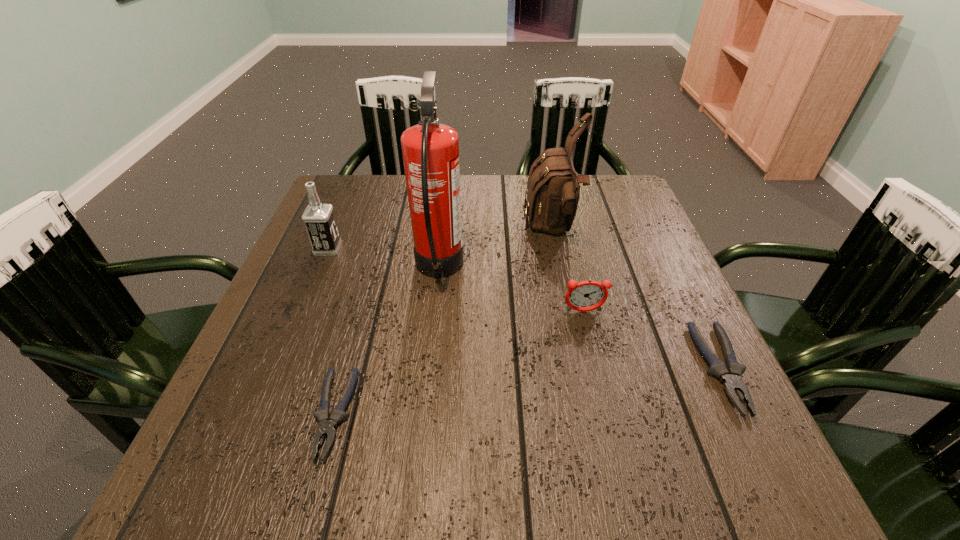
Where is `alarm clock`? The image size is (960, 540). alarm clock is located at coordinates coord(585,296).

The width and height of the screenshot is (960, 540). Identify the location of vacant area located 0.310m on the front-facing side of the third object from left to right. (595, 269).

This screenshot has width=960, height=540. I want to click on free location located on the front label of the fourth shortest object, so click(x=501, y=248).

Where is `free space located on the front-facing side of the fifth shortest object`? free space located on the front-facing side of the fifth shortest object is located at coordinates (386, 231).

Identify the location of vacant region located 0.160m on the front-facing side of the fifth shortest object. The height and width of the screenshot is (540, 960). (463, 231).

Identify the location of vacant area situated on the front-facing side of the fifth shortest object. This screenshot has width=960, height=540. (405, 231).

This screenshot has width=960, height=540. Identify the location of vacant position located on the front-facing side of the fourth farthest object. (592, 349).

This screenshot has width=960, height=540. In order to click on object located at the far edge in this screenshot , I will do `click(553, 188)`.

The height and width of the screenshot is (540, 960). Find the location of `object located in the left edge section of the desktop`. object located in the left edge section of the desktop is located at coordinates (319, 219).

At what (x,y) coordinates should I click in order to perform the action: click on object positioned at the right edge. Please return your answer as a coordinate pair (x, y). Looking at the image, I should click on (730, 375).